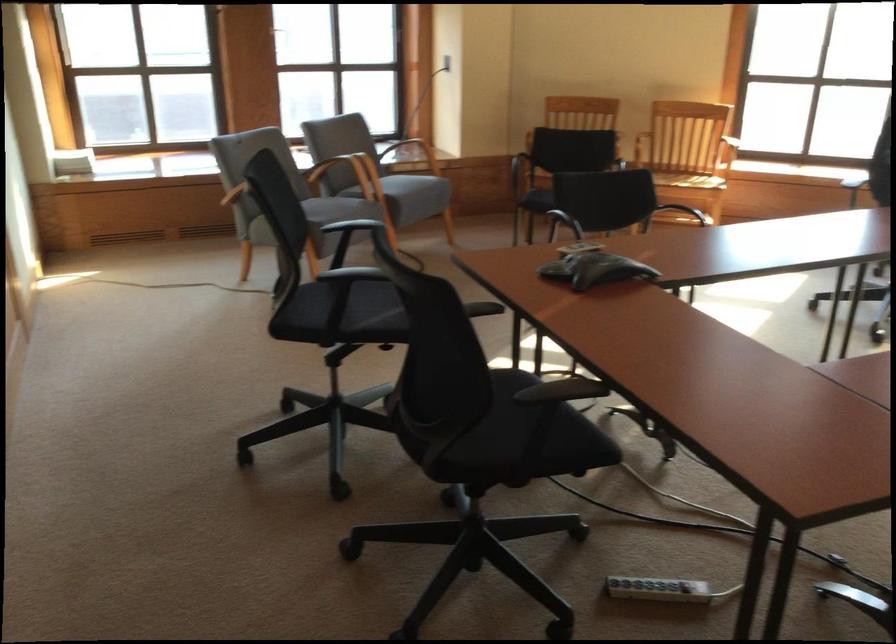
Which object does [657,589] point to?

This point indicates the white power strip.